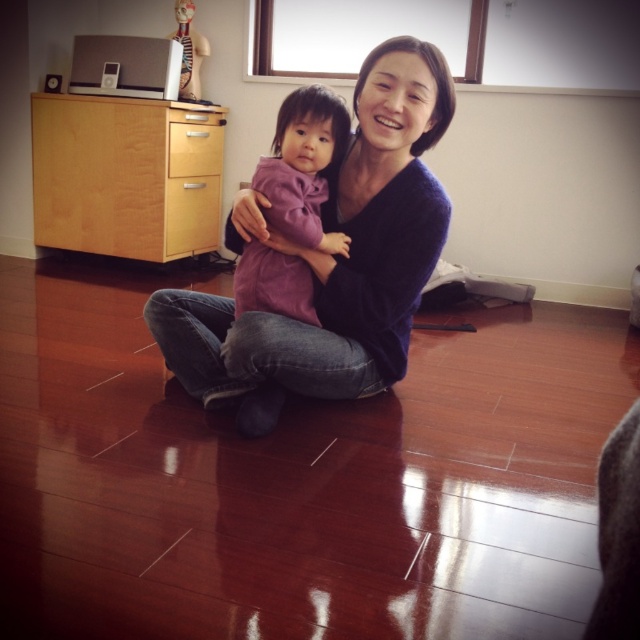
Consider the image. You are an interior designer planning to place a small decorative item on the dark blue sweater at center. The sweater is located at coordinate point 0.408, 0.519. If the cabinet is at coordinate point 0.600, 0.700, which object is closer to the cabinet?

The dark blue sweater at center is located at point (332, 260), and the cabinet is at point (448, 384). Calculating the distance between them, the sweater is closer to the cabinet than the cabinet itself. Wait, that doesn

You are a furniture designer who wants to place a new 20 cm wide decorative item between the light wood dresser at left and the light wood drawer at left. Based on the scene, will there be enough space between them to fit the item?

The distance between the light wood dresser at left and the light wood drawer at left is 19.81 centimeters. Since the decorative item is 20 cm wide, there is not enough space to fit it between them.

You are standing in the living room and want to place a small decoration on the wooden cabinet. You have two options for placement points on the cabinet top surface. The first point is at coordinates point (160, 131) and the second is at point (179, 236). Which point is closer to you?

Point (160, 131) is closer to the viewer than point (179, 236).